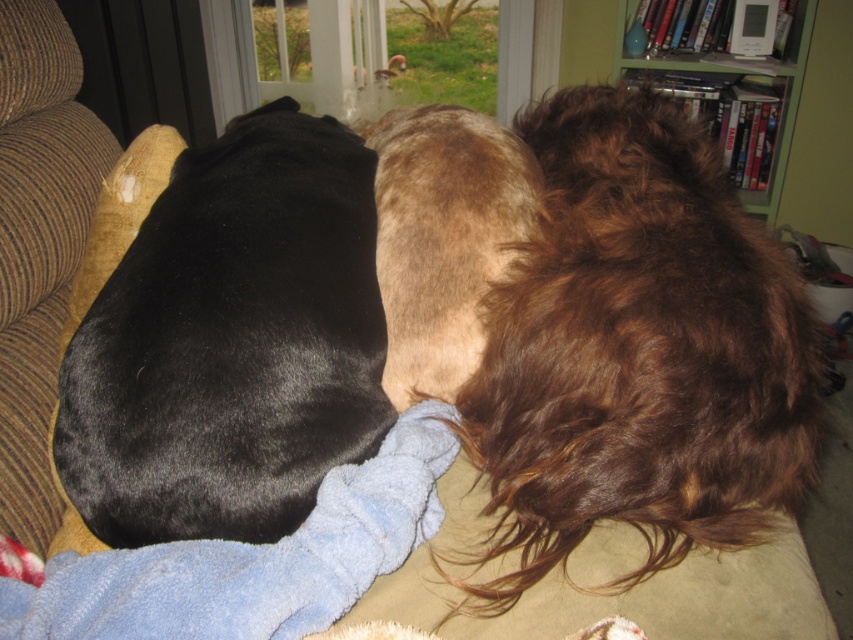
Question: Does black fur dog at left have a smaller size compared to brown fuzzy dog at center?

Choices:
 (A) no
 (B) yes

Answer: (A)

Question: Does brown fuzzy dog at center appear under transparent glass door at upper center?

Choices:
 (A) no
 (B) yes

Answer: (B)

Question: Does brown fluffy dog at center have a greater width compared to green wood bookshelf at upper right?

Choices:
 (A) no
 (B) yes

Answer: (B)

Question: Which point is farther to the camera?

Choices:
 (A) (798, 4)
 (B) (508, 195)

Answer: (A)

Question: Considering the real-world distances, which object is farthest from the brown fluffy dog at center?

Choices:
 (A) black fur dog at left
 (B) brown fuzzy dog at center
 (C) transparent glass door at upper center

Answer: (C)

Question: Which point is closer to the camera taking this photo?

Choices:
 (A) (68, 442)
 (B) (670, 340)
 (C) (766, 77)

Answer: (A)